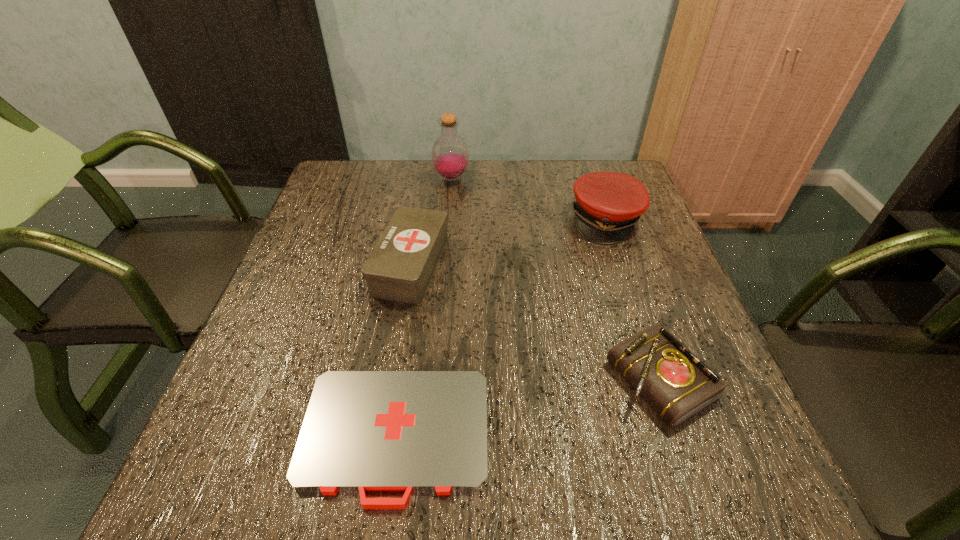
You are a GUI agent. You are given a task and a screenshot of the screen. Output one action in this format:
    pyautogui.click(x=<x>, y=<y>)
    Task: Click on the blank region between the second shortest object and the bottle
    The image size is (960, 540).
    Given the screenshot: What is the action you would take?
    pyautogui.click(x=556, y=279)

The width and height of the screenshot is (960, 540). I want to click on free spot between the cap and the farther first-aid kit, so click(x=509, y=242).

The width and height of the screenshot is (960, 540). Find the location of `free point between the second tallest object and the farthest object`. free point between the second tallest object and the farthest object is located at coordinates (529, 199).

You are a GUI agent. You are given a task and a screenshot of the screen. Output one action in this format:
    pyautogui.click(x=<x>, y=<y>)
    Task: Click on the blank region between the second tallest object and the nearer first-aid kit
    This screenshot has width=960, height=540.
    Given the screenshot: What is the action you would take?
    pyautogui.click(x=500, y=328)

You are a GUI agent. You are given a task and a screenshot of the screen. Output one action in this format:
    pyautogui.click(x=<x>, y=<y>)
    Task: Click on the vacant space that's between the fourth tallest object and the cap
    
    Given the screenshot: What is the action you would take?
    click(x=633, y=300)

The height and width of the screenshot is (540, 960). Identify the location of vacant space in between the nearer first-aid kit and the fourth shortest object. click(500, 328).

Find the location of a particular element. object identified as the second closest to the fourth shortest object is located at coordinates (675, 383).

Locate which object is the third closest to the cap. Please provide its 2D coordinates. Your answer should be formatted as a tuple, i.e. [(x, y)], where the tuple contains the x and y coordinates of a point satisfying the conditions above.

[(400, 267)]

Identify the location of vacant region that satisfies the following two spatial constraints: 1. on the front side of the diary; 2. on the left side of the tallest object. (434, 380).